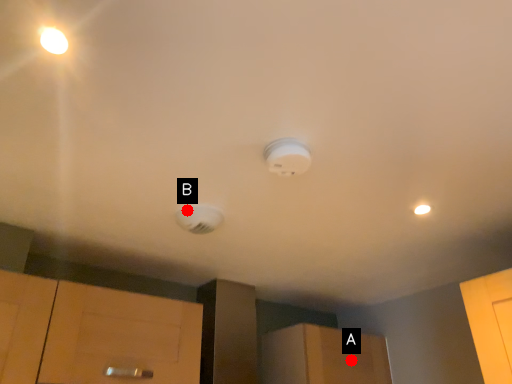
Question: Two points are circled on the image, labeled by A and B beside each circle. Which point is farther to the camera?

Choices:
 (A) A is further
 (B) B is further

Answer: (A)